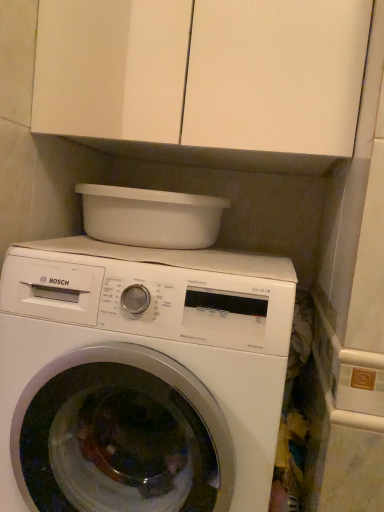
Question: Relative to white plastic basin at upper center, is white matte cabinet at upper center in front or behind?

Choices:
 (A) behind
 (B) front

Answer: (B)

Question: Is white matte cabinet at upper center wider or thinner than white plastic basin at upper center?

Choices:
 (A) wide
 (B) thin

Answer: (A)

Question: Estimate the real-world distances between objects in this image. Which object is farther from the white plastic basin at upper center?

Choices:
 (A) white glossy washing machine at center
 (B) white matte cabinet at upper center

Answer: (A)

Question: Estimate the real-world distances between objects in this image. Which object is closer to the white glossy washing machine at center?

Choices:
 (A) white matte cabinet at upper center
 (B) white plastic basin at upper center

Answer: (B)